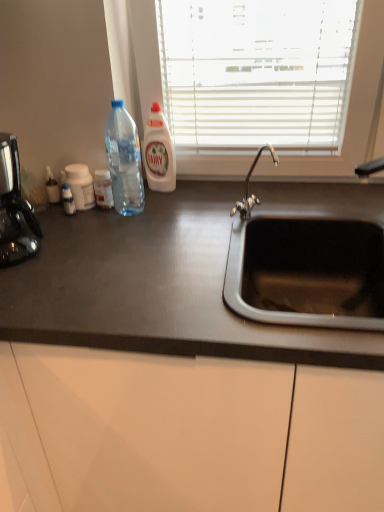
Question: Considering the relative positions of clear plastic bottle at center, which ranks as the second bottle in right-to-left order, and white plastic bottle at center in the image provided, is clear plastic bottle at center, which ranks as the second bottle in right-to-left order, to the left or to the right of white plastic bottle at center?

Choices:
 (A) left
 (B) right

Answer: (A)

Question: From a real-world perspective, is clear plastic bottle at center, the 2th bottle positioned from the left, physically located above or below white plastic bottle at center?

Choices:
 (A) below
 (B) above

Answer: (A)

Question: Estimate the real-world distances between objects in this image. Which object is closer to the white plastic bottle at left, positioned as the first bottle in left-to-right order?

Choices:
 (A) white plastic bottle at center
 (B) transparent plastic bottle at left, the 3th bottle viewed from the left
 (C) satin black coffee machine at left
 (D) black matte countertop at center
 (E) clear plastic bottle at center, the 2th bottle positioned from the left

Answer: (E)

Question: Considering the real-world distances, which object is closest to the satin black coffee machine at left?

Choices:
 (A) white plastic bottle at center
 (B) clear plastic bottle at center, the 2th bottle positioned from the left
 (C) white plastic bottle at left, positioned as the first bottle in left-to-right order
 (D) black matte countertop at center
 (E) transparent plastic bottle at left, the 1th bottle viewed from the right

Answer: (C)